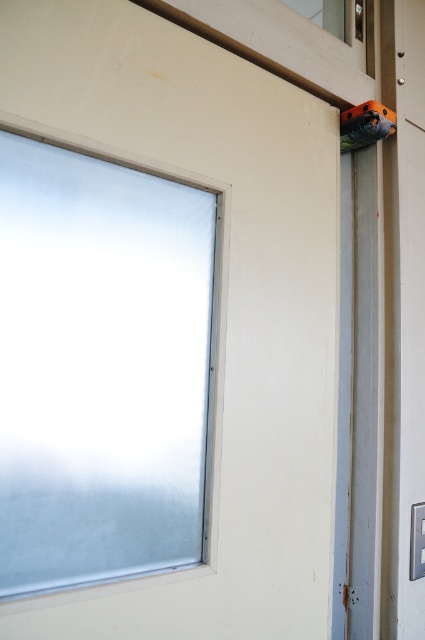
Between frosted glass window at upper left and orange plastic drill at upper right, which one appears on the left side from the viewer's perspective?

From the viewer's perspective, frosted glass window at upper left appears more on the left side.

Does frosted glass window at upper left appear over orange plastic drill at upper right?

Actually, frosted glass window at upper left is below orange plastic drill at upper right.

Image resolution: width=425 pixels, height=640 pixels. What do you see at coordinates (102, 368) in the screenshot? I see `frosted glass window at upper left` at bounding box center [102, 368].

The width and height of the screenshot is (425, 640). Identify the location of frosted glass window at upper left. (102, 368).